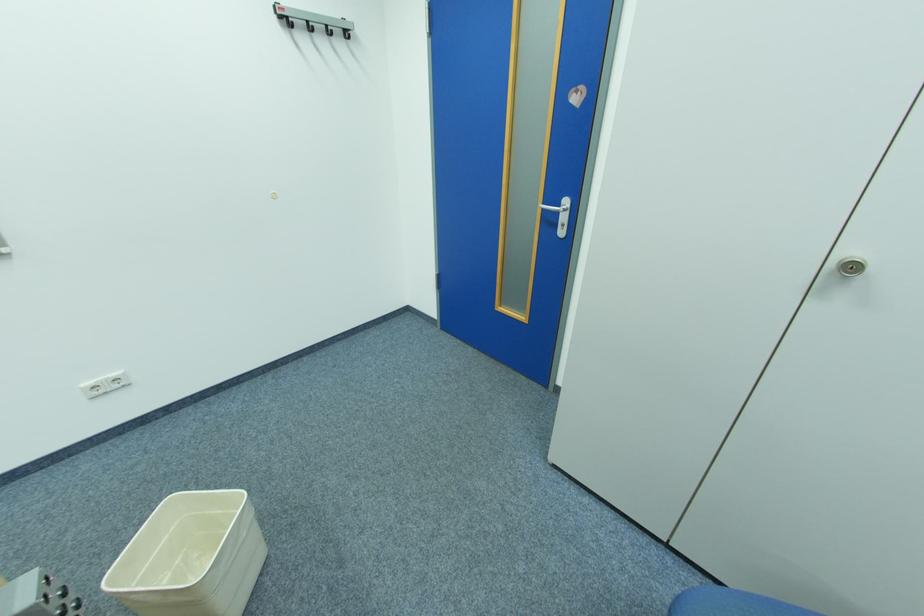
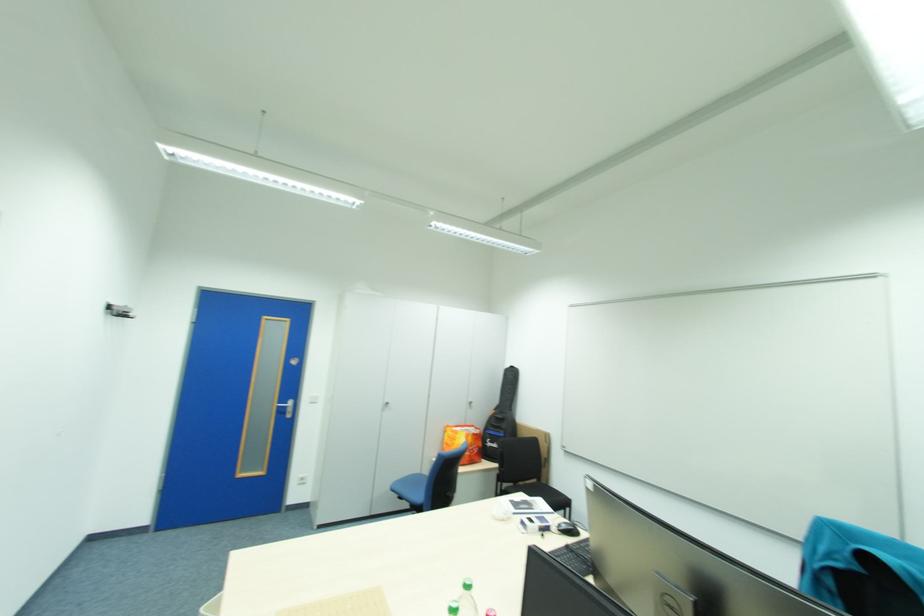
Where in the second image is the point corresponding to (552,209) from the first image?

(286, 407)